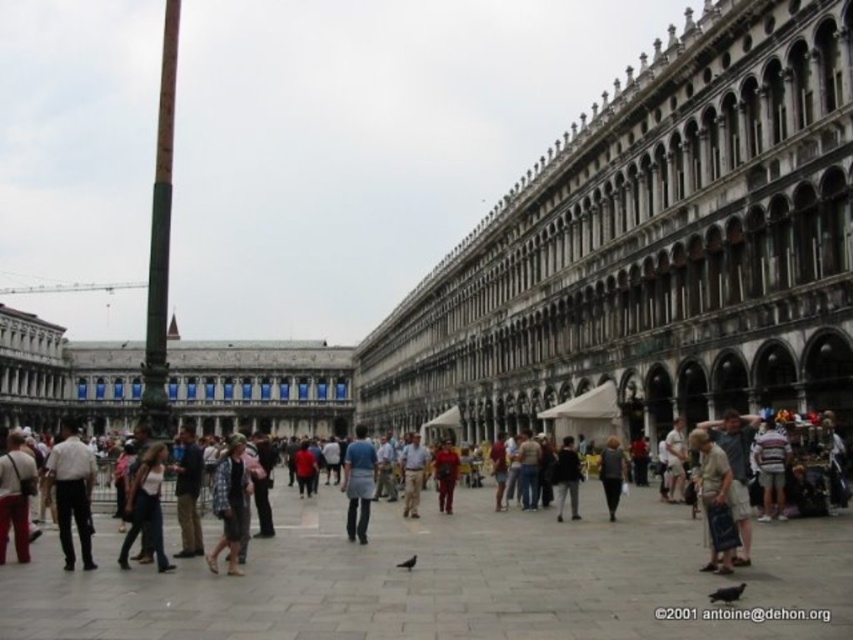
Which is behind, point (566, 298) or point (358, 426)?

The point (358, 426) is behind.

Is stone arches at center below blue denim jeans at center?

No, stone arches at center is not below blue denim jeans at center.

Describe the element at coordinates (654, 244) in the screenshot. I see `stone arches at center` at that location.

Find the location of a particular element. The width and height of the screenshot is (853, 640). stone arches at center is located at coordinates (654, 244).